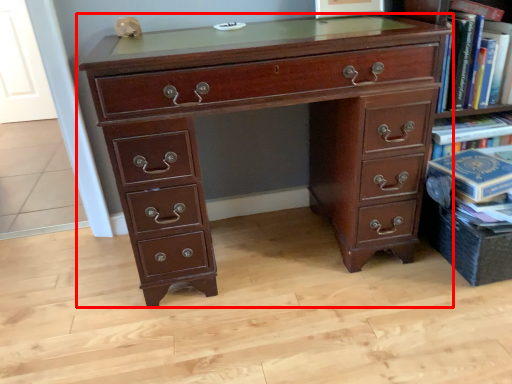
Question: From the image's perspective, what is the correct spatial relationship of chest of drawers (annotated by the red box) in relation to book?

Choices:
 (A) below
 (B) above

Answer: (A)